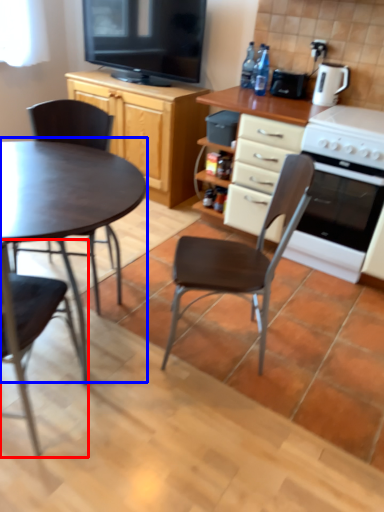
Question: Which of the following is the closest to the observer, chair (highlighted by a red box) or coffee table (highlighted by a blue box)?

Choices:
 (A) chair
 (B) coffee table

Answer: (A)